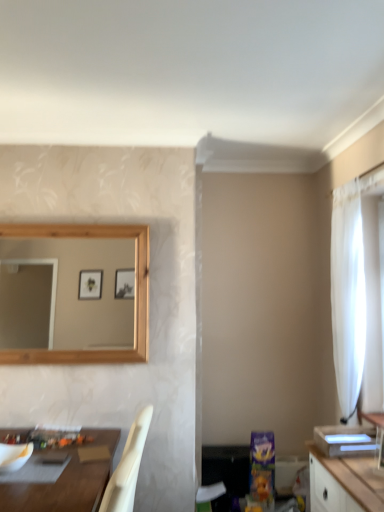
Question: Is brown wooden table at lower left located within white glossy vanity at right?

Choices:
 (A) no
 (B) yes

Answer: (A)

Question: Is white glossy vanity at right wider than brown wooden table at lower left?

Choices:
 (A) no
 (B) yes

Answer: (A)

Question: Is white glossy vanity at right to the right of brown wooden table at lower left from the viewer's perspective?

Choices:
 (A) yes
 (B) no

Answer: (A)

Question: Is white glossy vanity at right smaller than brown wooden table at lower left?

Choices:
 (A) no
 (B) yes

Answer: (B)

Question: Considering the relative positions of white glossy vanity at right and brown wooden table at lower left in the image provided, is white glossy vanity at right in front of brown wooden table at lower left?

Choices:
 (A) yes
 (B) no

Answer: (B)

Question: Relative to white matte mixing bowl at lower left, is white glossy vanity at right in front or behind?

Choices:
 (A) behind
 (B) front

Answer: (B)

Question: Is white glossy vanity at right bigger or smaller than white matte mixing bowl at lower left?

Choices:
 (A) small
 (B) big

Answer: (B)

Question: From a real-world perspective, is white glossy vanity at right positioned above or below white matte mixing bowl at lower left?

Choices:
 (A) above
 (B) below

Answer: (A)

Question: Which is correct: white glossy vanity at right is inside white matte mixing bowl at lower left, or outside of it?

Choices:
 (A) outside
 (B) inside

Answer: (A)

Question: Based on their sizes in the image, would you say white glossy vanity at right is bigger or smaller than white sheer curtain at right?

Choices:
 (A) small
 (B) big

Answer: (A)

Question: From a real-world perspective, relative to white sheer curtain at right, is white glossy vanity at right vertically above or below?

Choices:
 (A) above
 (B) below

Answer: (B)

Question: From the image's perspective, is white glossy vanity at right above or below white sheer curtain at right?

Choices:
 (A) above
 (B) below

Answer: (B)

Question: Relative to white sheer curtain at right, is white glossy vanity at right in front or behind?

Choices:
 (A) behind
 (B) front

Answer: (B)

Question: From their relative heights in the image, would you say white matte mixing bowl at lower left is taller or shorter than white glossy vanity at right?

Choices:
 (A) short
 (B) tall

Answer: (A)

Question: Is point (8, 459) positioned closer to the camera than point (377, 420)?

Choices:
 (A) farther
 (B) closer

Answer: (B)